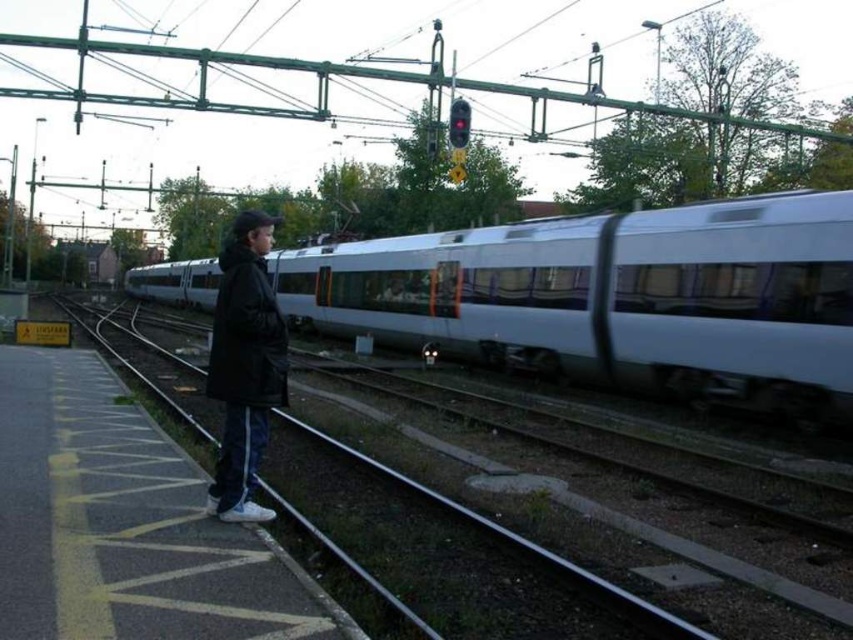
Who is shorter, silver metallic train at center or metallic train track at center?

Standing shorter between the two is metallic train track at center.

Does silver metallic train at center appear under metallic train track at center?

No.

Is point (222, 266) more distant than point (489, 477)?

No.

I want to click on silver metallic train at center, so click(x=614, y=298).

Can you confirm if metallic train track at center is positioned to the left of black matte jacket at left?

Incorrect, metallic train track at center is not on the left side of black matte jacket at left.

The height and width of the screenshot is (640, 853). What do you see at coordinates (601, 516) in the screenshot? I see `metallic train track at center` at bounding box center [601, 516].

At what (x,y) coordinates should I click in order to perform the action: click on metallic train track at center. Please return your answer as a coordinate pair (x, y). This screenshot has height=640, width=853. Looking at the image, I should click on (601, 516).

From the picture: How far apart are silver metallic train at center and black matte jacket at left?

The distance of silver metallic train at center from black matte jacket at left is 7.28 meters.

Is the position of silver metallic train at center more distant than that of black matte jacket at left?

Yes.

The height and width of the screenshot is (640, 853). Describe the element at coordinates (614, 298) in the screenshot. I see `silver metallic train at center` at that location.

I want to click on silver metallic train at center, so click(x=614, y=298).